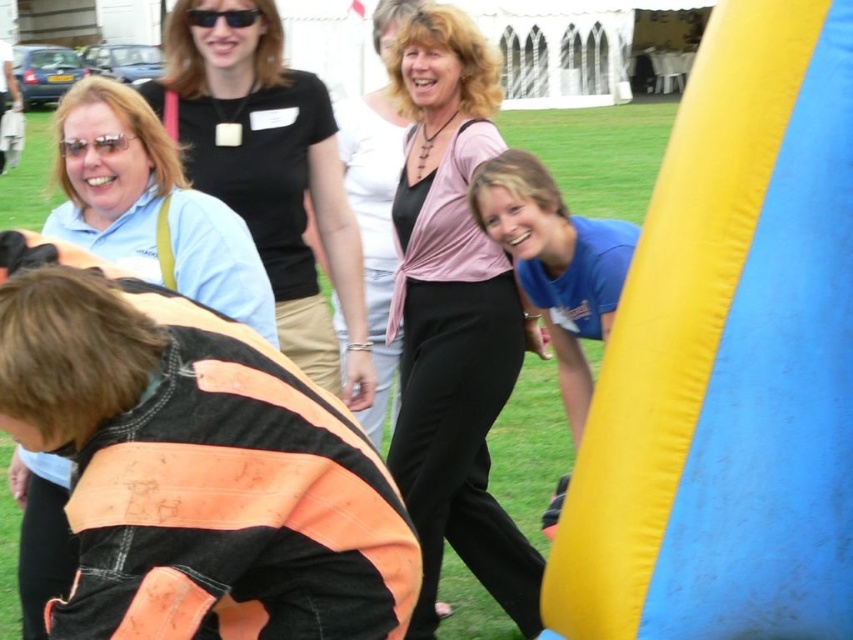
Is point (454, 323) closer to camera compared to point (489, 205)?

That is False.

Is the position of pink fabric top at center less distant than that of blue cotton shirt at lower right?

No, it is not.

Is point (433, 380) behind point (610, 220)?

Yes, it is.

Where is `pink fabric top at center`? pink fabric top at center is located at coordinates (453, 317).

Does pink fabric top at center have a smaller size compared to matte black shirt at upper left?

Indeed, pink fabric top at center has a smaller size compared to matte black shirt at upper left.

Locate an element on the screen. The height and width of the screenshot is (640, 853). pink fabric top at center is located at coordinates (453, 317).

Does matte black shirt at upper left have a greater width compared to blue cotton shirt at lower right?

Indeed, matte black shirt at upper left has a greater width compared to blue cotton shirt at lower right.

Between matte black shirt at upper left and blue cotton shirt at lower right, which one has less height?

Standing shorter between the two is blue cotton shirt at lower right.

Is point (357, 352) less distant than point (627, 232)?

No, it is behind (627, 232).

Locate an element on the screen. matte black shirt at upper left is located at coordinates (270, 170).